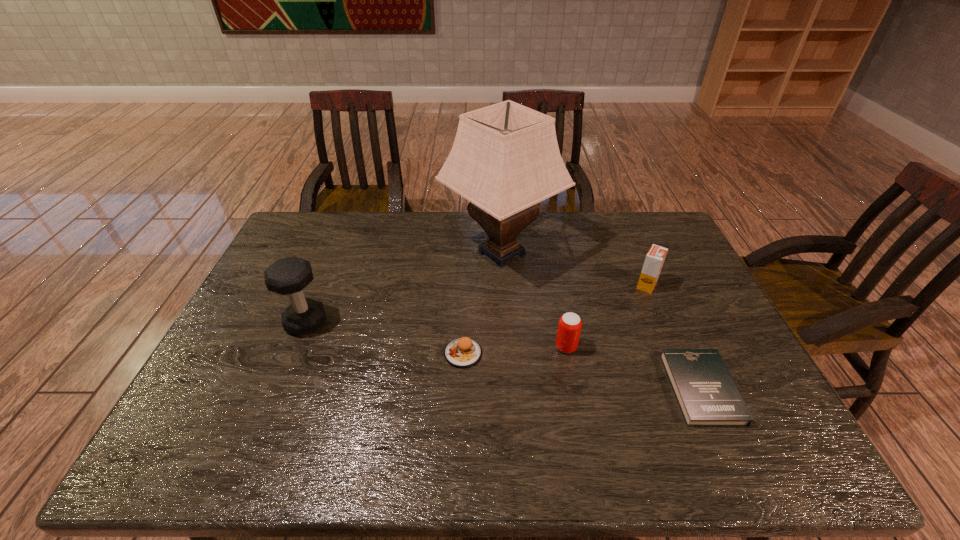
In the image, there is a desktop. Identify the location of vacant area at the right edge. The height and width of the screenshot is (540, 960). (672, 267).

Identify the location of vacant area at the near right corner of the desktop. (785, 468).

Find the location of a particular element. vacant area that lies between the leftmost object and the book is located at coordinates (504, 356).

Image resolution: width=960 pixels, height=540 pixels. I want to click on vacant space in between the leftmost object and the patty, so click(x=385, y=338).

Identify the location of free spot between the lampshade and the beer can. The height and width of the screenshot is (540, 960). (534, 300).

At what (x,y) coordinates should I click in order to perform the action: click on vacant area that lies between the third farthest object and the patty. Please return your answer as a coordinate pair (x, y). The width and height of the screenshot is (960, 540). Looking at the image, I should click on (385, 338).

You are a GUI agent. You are given a task and a screenshot of the screen. Output one action in this format:
    pyautogui.click(x=<x>, y=<y>)
    Task: Click on the vacant space in between the lampshade and the orange juice
    The image size is (960, 540).
    Given the screenshot: What is the action you would take?
    tap(574, 269)

In order to click on vacant space in between the tallest object and the second shortest object in this screenshot , I will do `click(482, 303)`.

This screenshot has width=960, height=540. I want to click on free space between the tallest object and the third shortest object, so click(x=534, y=300).

At what (x,y) coordinates should I click in order to perform the action: click on free space that is in between the shortest object and the tallest object. Please return your answer as a coordinate pair (x, y). Looking at the image, I should click on (602, 321).